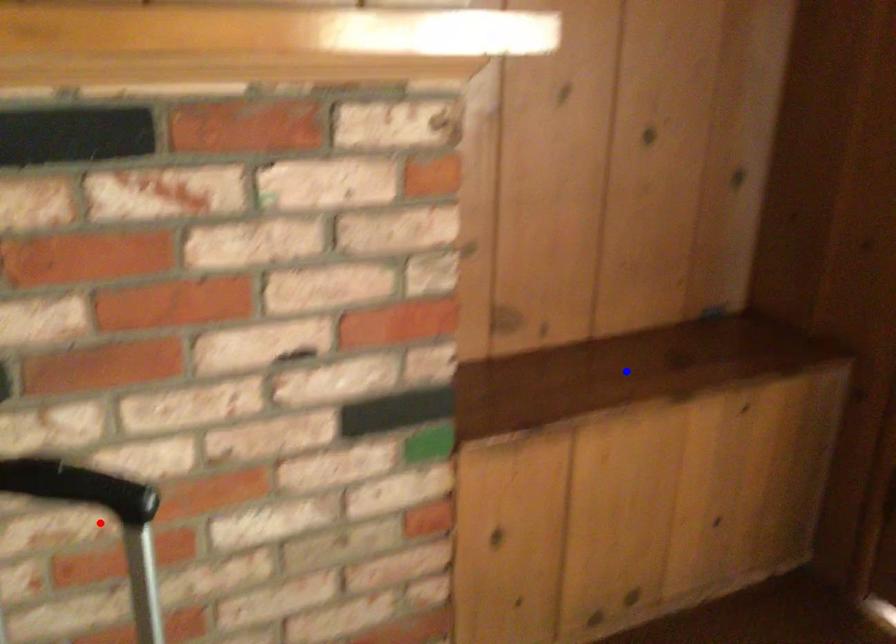
Question: Which of the two points in the image is closer to the camera?

Choices:
 (A) Blue point is closer.
 (B) Red point is closer.

Answer: (B)